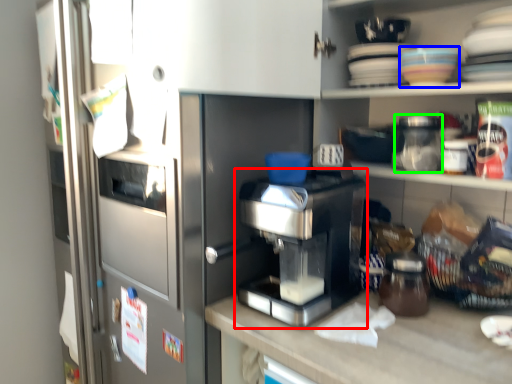
Question: Which object is the farthest from home appliance (highlighted by a red box)? Choose among these: tableware (highlighted by a blue box) or glass jar (highlighted by a green box).

Choices:
 (A) tableware
 (B) glass jar

Answer: (A)